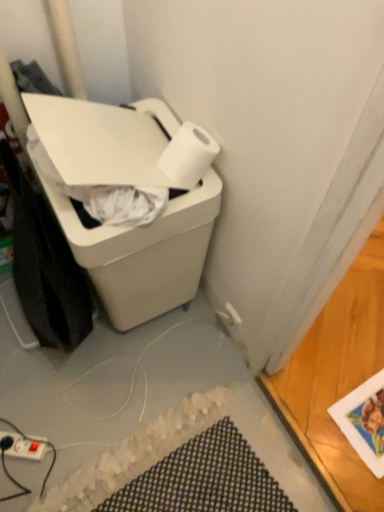
The image size is (384, 512). What are the coordinates of `vacant space to the right of matte white power plugs and sockets at lower left` in the screenshot? It's located at [x=71, y=444].